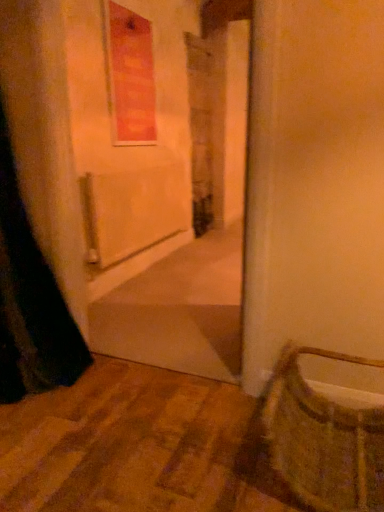
Question: Is woven straw basket at lower right shorter than matte orange window at upper center?

Choices:
 (A) yes
 (B) no

Answer: (A)

Question: Considering the relative sizes of woven straw basket at lower right and matte orange window at upper center in the image provided, is woven straw basket at lower right taller than matte orange window at upper center?

Choices:
 (A) no
 (B) yes

Answer: (A)

Question: Is woven straw basket at lower right closer to the viewer compared to matte orange window at upper center?

Choices:
 (A) no
 (B) yes

Answer: (B)

Question: Is woven straw basket at lower right located outside matte orange window at upper center?

Choices:
 (A) no
 (B) yes

Answer: (B)

Question: From a real-world perspective, is woven straw basket at lower right positioned under matte orange window at upper center based on gravity?

Choices:
 (A) no
 (B) yes

Answer: (B)

Question: Is woven straw basket at lower right looking in the opposite direction of matte orange window at upper center?

Choices:
 (A) no
 (B) yes

Answer: (A)

Question: Considering the relative sizes of matte orange window at upper center and woven straw basket at lower right in the image provided, is matte orange window at upper center wider than woven straw basket at lower right?

Choices:
 (A) yes
 (B) no

Answer: (B)

Question: Is matte orange window at upper center smaller than woven straw basket at lower right?

Choices:
 (A) no
 (B) yes

Answer: (B)

Question: Can you confirm if matte orange window at upper center is shorter than woven straw basket at lower right?

Choices:
 (A) no
 (B) yes

Answer: (A)

Question: From the image's perspective, is matte orange window at upper center below woven straw basket at lower right?

Choices:
 (A) no
 (B) yes

Answer: (A)

Question: Is matte orange window at upper center directly adjacent to woven straw basket at lower right?

Choices:
 (A) no
 (B) yes

Answer: (A)

Question: Can we say matte orange window at upper center lies outside woven straw basket at lower right?

Choices:
 (A) no
 (B) yes

Answer: (B)

Question: From a real-world perspective, is matte orange window at upper center positioned above or below woven straw basket at lower right?

Choices:
 (A) below
 (B) above

Answer: (B)